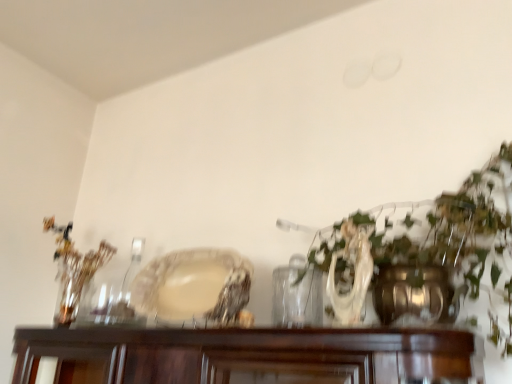
This screenshot has height=384, width=512. I want to click on matte glass plate at center, so click(x=194, y=286).

What do you see at coordinates (194, 286) in the screenshot? This screenshot has width=512, height=384. I see `matte glass plate at center` at bounding box center [194, 286].

I want to click on matte glass plate at center, so click(194, 286).